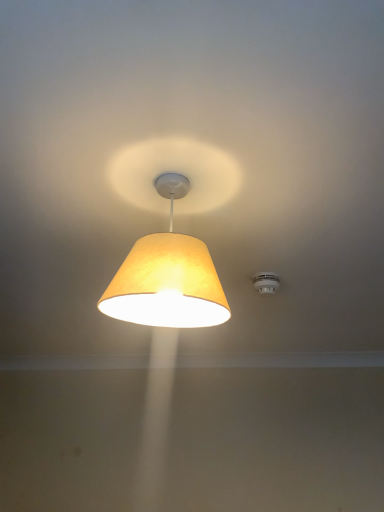
Question: From the image's perspective, relative to white plastic smoke detector at upper right, is matte yellow fabric lampshade at center above or below?

Choices:
 (A) above
 (B) below

Answer: (A)

Question: From a real-world perspective, is matte yellow fabric lampshade at center positioned above or below white plastic smoke detector at upper right?

Choices:
 (A) below
 (B) above

Answer: (A)

Question: Is point (180, 317) closer or farther from the camera than point (269, 287)?

Choices:
 (A) closer
 (B) farther

Answer: (A)

Question: Would you say white plastic smoke detector at upper right is to the left or to the right of matte yellow fabric lampshade at center in the picture?

Choices:
 (A) right
 (B) left

Answer: (A)

Question: From the image's perspective, is white plastic smoke detector at upper right above or below matte yellow fabric lampshade at center?

Choices:
 (A) below
 (B) above

Answer: (A)

Question: Is white plastic smoke detector at upper right wider or thinner than matte yellow fabric lampshade at center?

Choices:
 (A) thin
 (B) wide

Answer: (A)

Question: In terms of size, does white plastic smoke detector at upper right appear bigger or smaller than matte yellow fabric lampshade at center?

Choices:
 (A) small
 (B) big

Answer: (A)